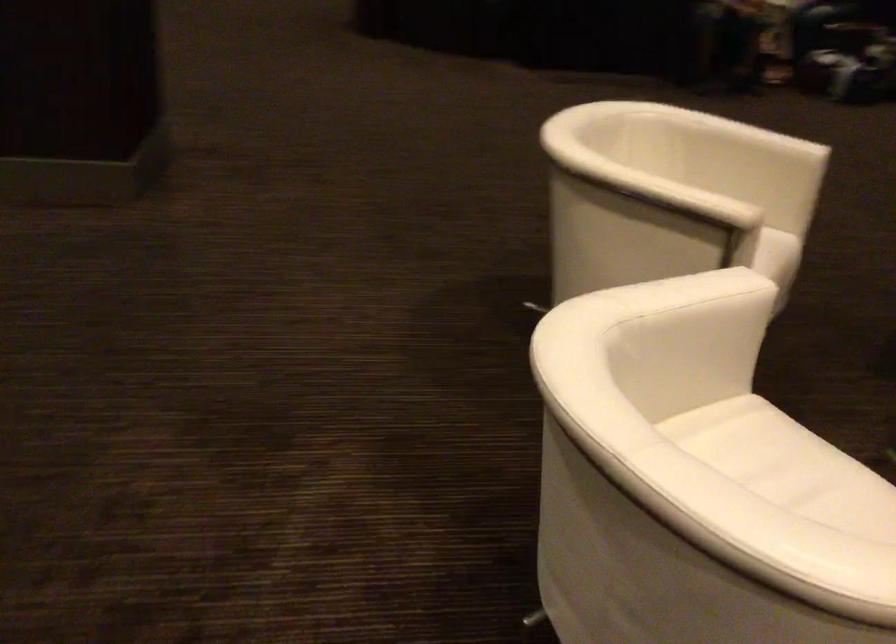
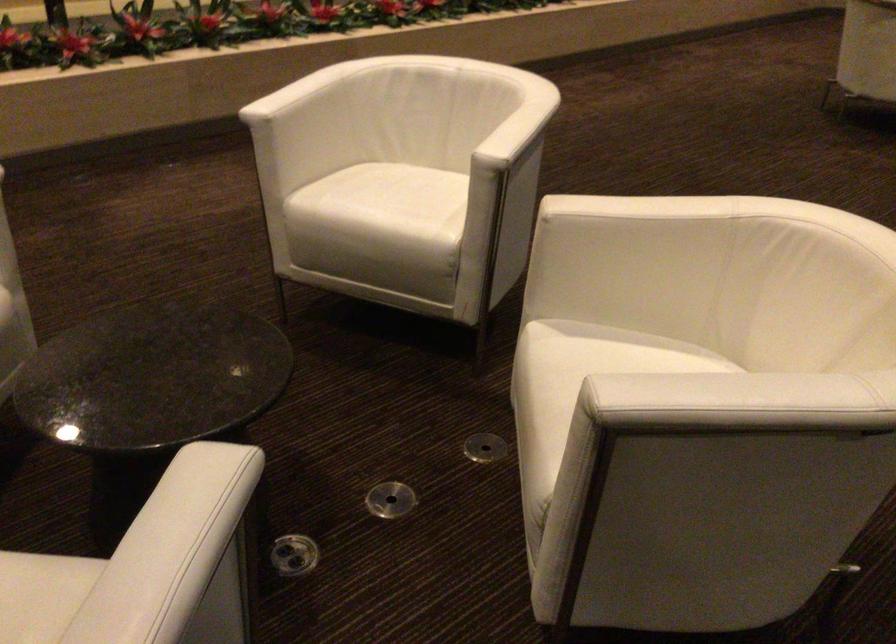
Locate, in the second image, the point that corresponds to point 690,275 in the first image.

(515, 122)